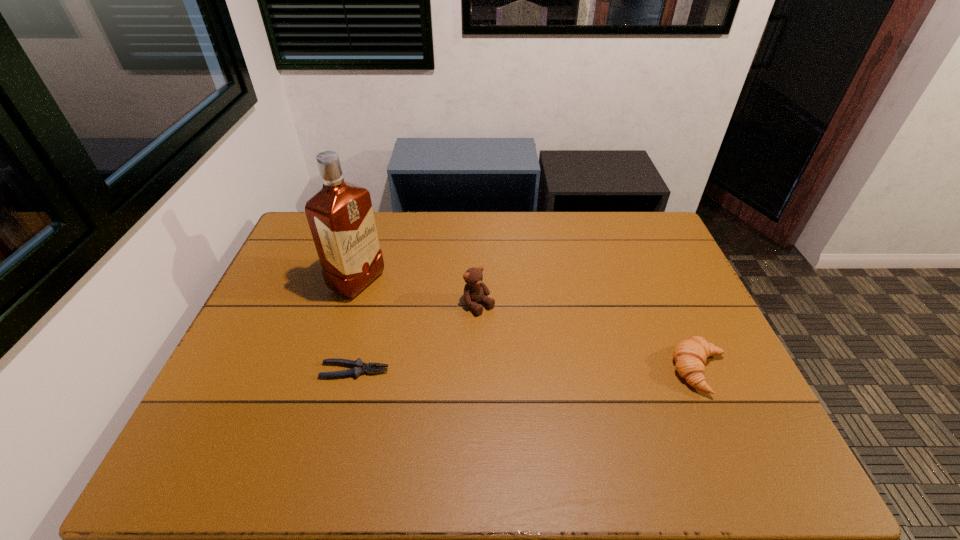
Image resolution: width=960 pixels, height=540 pixels. I want to click on free spot on the desktop that is between the pliers and the crescent roll and is positioned on the face of the teddy bear, so pyautogui.click(x=546, y=370).

Identify the location of free space on the desktop that is between the shortest object and the third tallest object and is positioned on the front label of the tallest object. This screenshot has width=960, height=540. (553, 370).